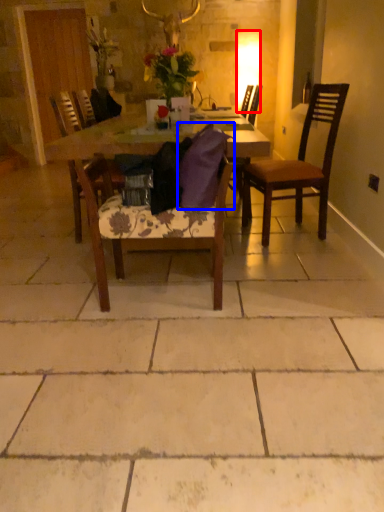
Question: Which object is further to the camera taking this photo, lamp (highlighted by a red box) or pillow (highlighted by a blue box)?

Choices:
 (A) lamp
 (B) pillow

Answer: (A)